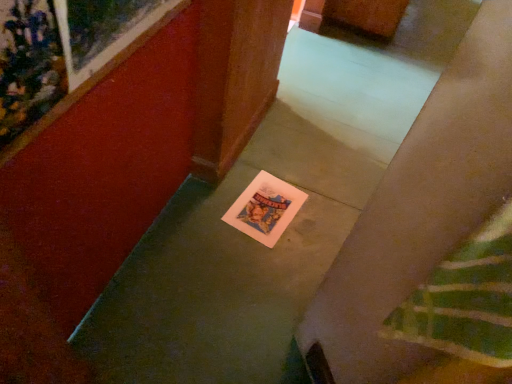
Locate an element on the screen. The image size is (512, 384). vacant region below white paper postcard at center (from a real-world perspective) is located at coordinates (261, 211).